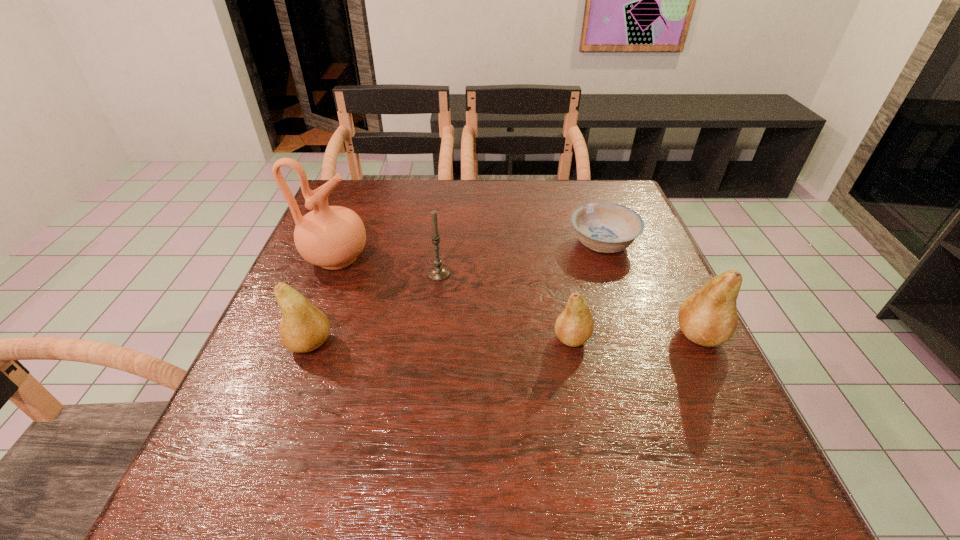
The image size is (960, 540). Identify the location of vacant space at the right edge. (615, 281).

Image resolution: width=960 pixels, height=540 pixels. I want to click on free space at the far left corner of the desktop, so click(x=356, y=203).

In the image, there is a desktop. Identify the location of vacant space at the far right corner. (620, 198).

The image size is (960, 540). In order to click on free space between the rightmost pear and the leftmost pear in this screenshot , I will do `click(505, 340)`.

Where is `free spot between the third object from right to left and the candle`? The image size is (960, 540). free spot between the third object from right to left and the candle is located at coordinates (505, 306).

Where is `free point between the bowl and the second pear from left to right`? This screenshot has height=540, width=960. free point between the bowl and the second pear from left to right is located at coordinates (588, 291).

Identify the location of empty space that is in between the rightmost pear and the second shortest pear. This screenshot has width=960, height=540. (505, 340).

Identify the location of free space between the third object from right to left and the third object from left to right. This screenshot has width=960, height=540. (505, 306).

Find the location of a particular element. The width and height of the screenshot is (960, 540). free space between the pottery and the second tallest pear is located at coordinates (324, 301).

This screenshot has width=960, height=540. I want to click on unoccupied position between the shortest pear and the leftmost pear, so click(441, 341).